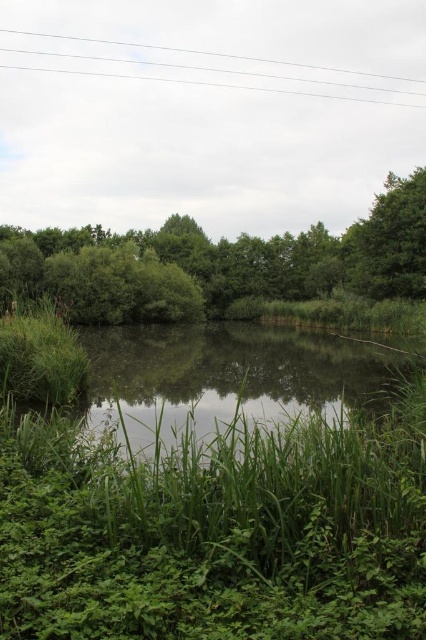
Question: Which of the following is the closest to the observer?

Choices:
 (A) (212, 364)
 (B) (206, 278)
 (C) (397, 288)

Answer: (A)

Question: Can you confirm if green leafy tree at center is bigger than green leafy tree at upper right?

Choices:
 (A) yes
 (B) no

Answer: (A)

Question: Considering the real-world distances, which object is closest to the green grassy river at center?

Choices:
 (A) white wire at upper center
 (B) green leafy tree at upper right
 (C) green leafy tree at center

Answer: (B)

Question: Which point is closer to the camera taking this photo?

Choices:
 (A) (187, 216)
 (B) (169, 340)

Answer: (B)

Question: Can you confirm if green leafy tree at upper right is smaller than white wire at upper center?

Choices:
 (A) no
 (B) yes

Answer: (B)

Question: Does green leafy tree at upper right have a larger size compared to white wire at upper center?

Choices:
 (A) no
 (B) yes

Answer: (A)